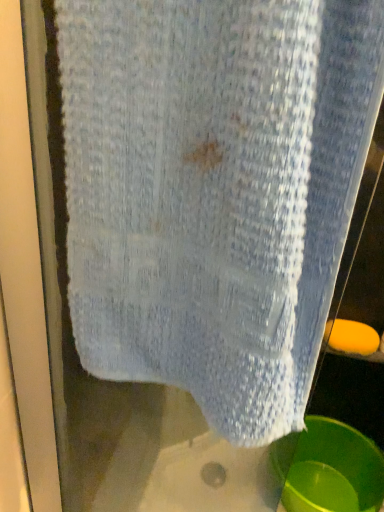
Describe the element at coordinates (330, 469) in the screenshot. I see `green plastic basin at lower right` at that location.

The image size is (384, 512). Find the location of `green plastic basin at lower right`. green plastic basin at lower right is located at coordinates (330, 469).

The height and width of the screenshot is (512, 384). What do you see at coordinates (351, 337) in the screenshot? I see `orange matte soap at lower right` at bounding box center [351, 337].

You are a GUI agent. You are given a task and a screenshot of the screen. Output one action in this format:
    pyautogui.click(x=<x>, y=<y>)
    Task: Click on the orange matte soap at lower right
    The image size is (384, 512).
    Given the screenshot: What is the action you would take?
    pyautogui.click(x=351, y=337)

Measure the distance between point (356, 350) and camera.

1.30 meters.

At what (x,y) coordinates should I click in order to perform the action: click on green plastic basin at lower right. Please return your answer as a coordinate pair (x, y). Looking at the image, I should click on (330, 469).

In the scene shown: Considering the positions of objects orange matte soap at lower right and green plastic basin at lower right in the image provided, who is more to the left, orange matte soap at lower right or green plastic basin at lower right?

Positioned to the left is green plastic basin at lower right.

From the picture: Between orange matte soap at lower right and green plastic basin at lower right, which one is positioned behind?

Positioned behind is orange matte soap at lower right.

Is point (346, 322) less distant than point (301, 436)?

Yes.

From the image's perspective, which is below, orange matte soap at lower right or green plastic basin at lower right?

From the image's view, green plastic basin at lower right is below.

Based on the photo, from a real-world perspective, does orange matte soap at lower right sit lower than green plastic basin at lower right?

No.

Which of these two, orange matte soap at lower right or green plastic basin at lower right, is thinner?

orange matte soap at lower right is thinner.

Between orange matte soap at lower right and green plastic basin at lower right, which one has more height?

Standing taller between the two is green plastic basin at lower right.

Who is bigger, orange matte soap at lower right or green plastic basin at lower right?

Bigger between the two is green plastic basin at lower right.

From the picture: Is orange matte soap at lower right not within green plastic basin at lower right?

Yes, orange matte soap at lower right is located beyond the bounds of green plastic basin at lower right.

Looking at this image, is orange matte soap at lower right not close to green plastic basin at lower right?

No, orange matte soap at lower right is not far away from green plastic basin at lower right.

Is orange matte soap at lower right looking in the opposite direction of green plastic basin at lower right?

No, orange matte soap at lower right is not facing the opposite direction of green plastic basin at lower right.

What's the angular difference between orange matte soap at lower right and green plastic basin at lower right's facing directions?

0.00169 degrees.

This screenshot has width=384, height=512. In order to click on basin lying in front of the orange matte soap at lower right in this screenshot , I will do `click(330, 469)`.

Looking at this image, would you say green plastic basin at lower right is to the left or to the right of orange matte soap at lower right in the picture?

Clearly, green plastic basin at lower right is on the left of orange matte soap at lower right in the image.

In the image, is green plastic basin at lower right positioned in front of or behind orange matte soap at lower right?

Visually, green plastic basin at lower right is located in front of orange matte soap at lower right.

Does point (343, 507) come behind point (331, 344)?

Yes, point (343, 507) is farther from viewer.

From the image's perspective, is green plastic basin at lower right below orange matte soap at lower right?

Indeed, from the image's perspective, green plastic basin at lower right is shown beneath orange matte soap at lower right.

From a real-world perspective, is green plastic basin at lower right located beneath orange matte soap at lower right?

Yes, from a real-world perspective, green plastic basin at lower right is below orange matte soap at lower right.

Can you confirm if green plastic basin at lower right is thinner than orange matte soap at lower right?

Incorrect, the width of green plastic basin at lower right is not less than that of orange matte soap at lower right.

Considering the sizes of green plastic basin at lower right and orange matte soap at lower right in the image, is green plastic basin at lower right taller or shorter than orange matte soap at lower right?

Considering their sizes, green plastic basin at lower right has more height than orange matte soap at lower right.

Who is bigger, green plastic basin at lower right or orange matte soap at lower right?

With larger size is green plastic basin at lower right.

Is green plastic basin at lower right not within orange matte soap at lower right?

Yes, green plastic basin at lower right is not within orange matte soap at lower right.

Based on the photo, would you consider green plastic basin at lower right to be distant from orange matte soap at lower right?

No, green plastic basin at lower right is not far away from orange matte soap at lower right.

Is green plastic basin at lower right aimed at orange matte soap at lower right?

No, green plastic basin at lower right is not aimed at orange matte soap at lower right.

Can you tell me how much green plastic basin at lower right and orange matte soap at lower right differ in facing direction?

0.00169 degrees.

In order to click on soap located behind the green plastic basin at lower right in this screenshot , I will do `click(351, 337)`.

Where is `soap above the green plastic basin at lower right (from a real-world perspective)`? soap above the green plastic basin at lower right (from a real-world perspective) is located at coordinates (351, 337).

Identify the location of basin below the orange matte soap at lower right (from the image's perspective). The height and width of the screenshot is (512, 384). pyautogui.click(x=330, y=469).